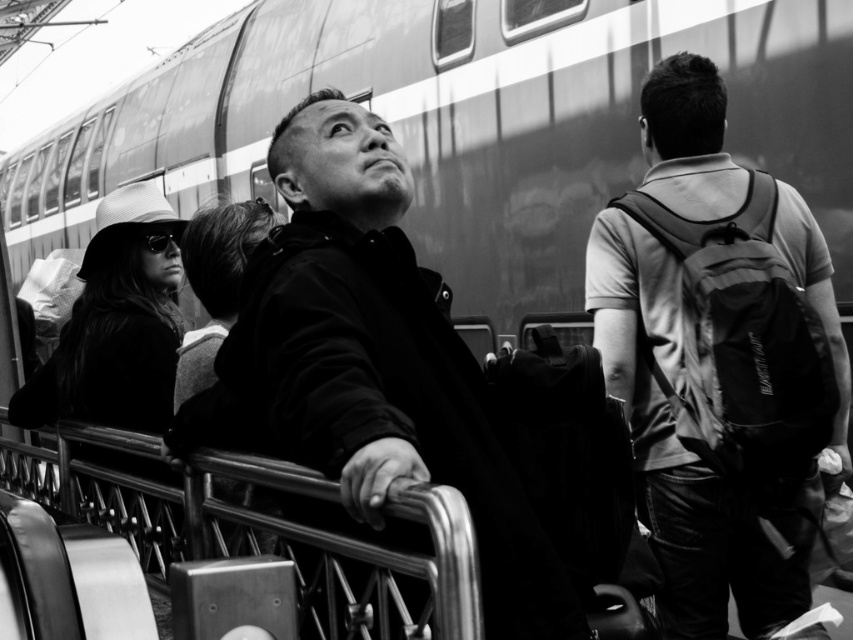
You are at the train station and want to ask the person in the matte black backpack at center a question. Which direction should you walk to approach the matte black jacket at center first?

The matte black jacket at center is in front of the matte black backpack at center, so you should walk towards the matte black jacket at center first to reach the backpack.

You are at a train station and see the matte black jacket at center and the matte black backpack at center. Which object is positioned more to the right side?

The matte black backpack at center is positioned more to the right side than the matte black jacket at center.

You are a photographer analyzing this black and white photo of a train station. You notice the matte black jacket at center and the matte black backpack at center. Which object is taller in the image?

The matte black backpack at center is taller than the matte black jacket at center according to the description.